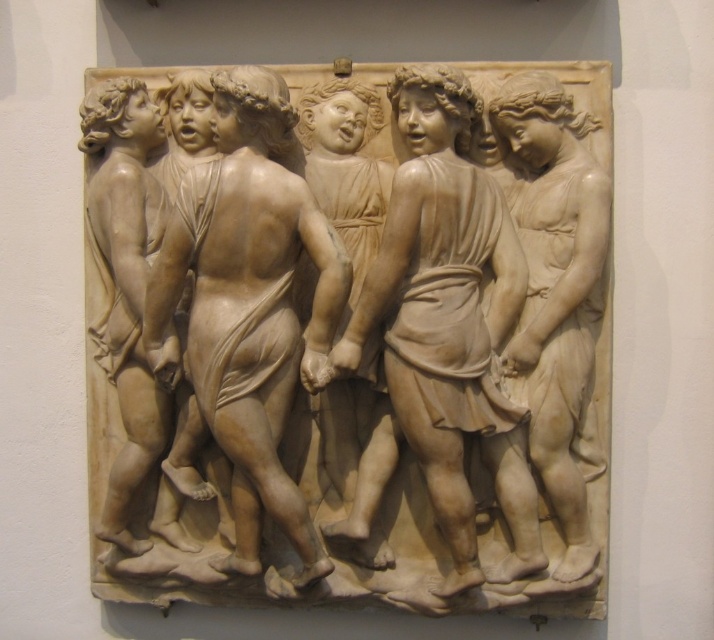
Question: Does white marble relief at center have a smaller size compared to smooth beige cherub at left?

Choices:
 (A) no
 (B) yes

Answer: (A)

Question: Based on their relative distances, which object is nearer to the matte white marble cherub at center?

Choices:
 (A) smooth beige statue at center
 (B) white marble cherub at right

Answer: (B)

Question: Which is farther from the smooth beige cherub at left?

Choices:
 (A) matte beige cherub at center
 (B) white marble cherub at right
 (C) matte white marble cherub at center

Answer: (B)

Question: Estimate the real-world distances between objects in this image. Which object is farther from the smooth beige statue at center?

Choices:
 (A) smooth beige cherub at left
 (B) white marble relief at center
 (C) matte beige cherub at center
 (D) matte white marble cherub at center

Answer: (D)

Question: Does smooth beige cherub at left come in front of matte beige cherub at center?

Choices:
 (A) yes
 (B) no

Answer: (B)

Question: Does matte white marble cherub at center appear on the left side of white marble cherub at right?

Choices:
 (A) yes
 (B) no

Answer: (A)